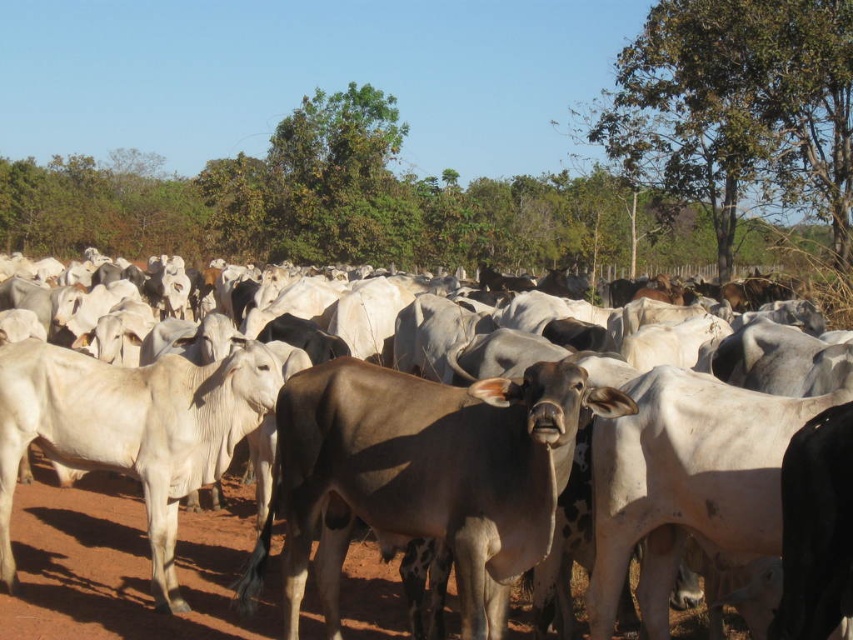
Question: Which point is closer to the camera taking this photo?

Choices:
 (A) (566, 400)
 (B) (218, 609)
 (C) (781, 131)

Answer: (A)

Question: Among these points, which one is farthest from the camera?

Choices:
 (A) (846, 102)
 (B) (357, 563)

Answer: (A)

Question: Does green leafy tree at upper right appear on the left side of white smooth cows at center?

Choices:
 (A) no
 (B) yes

Answer: (A)

Question: Is brown smooth cow at center to the right of green leafy tree at upper right from the viewer's perspective?

Choices:
 (A) yes
 (B) no

Answer: (B)

Question: Which object appears closest to the camera in this image?

Choices:
 (A) brown smooth cow at center
 (B) green leafy tree at upper right
 (C) white smooth cows at center

Answer: (A)

Question: Does brown smooth cow at center have a smaller size compared to white smooth cows at center?

Choices:
 (A) no
 (B) yes

Answer: (A)